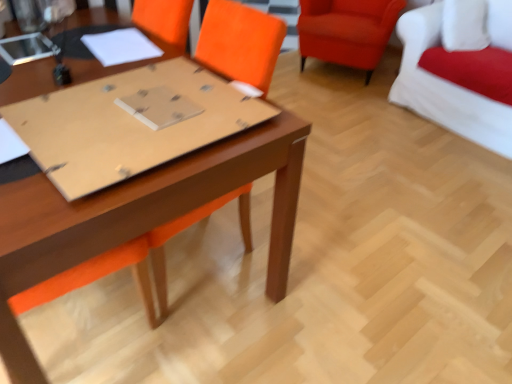
You are a GUI agent. You are given a task and a screenshot of the screen. Output one action in this format:
    pyautogui.click(x=<x>, y=<y>)
    Task: Click on the vacant area that is in front of white fabric couch at upper right, marked as the second chair in a left-to-right arrangement
    This screenshot has width=512, height=384.
    Given the screenshot: What is the action you would take?
    pyautogui.click(x=445, y=174)